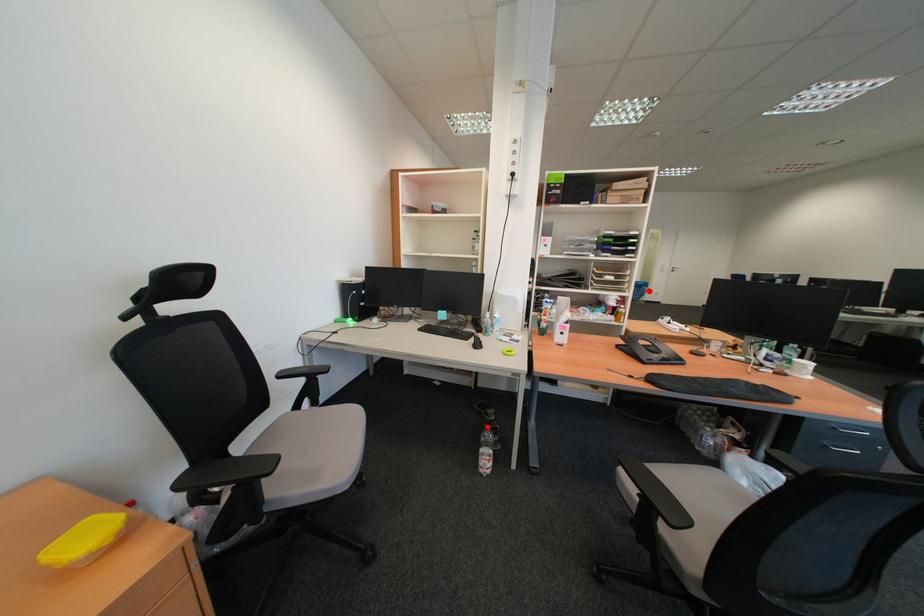
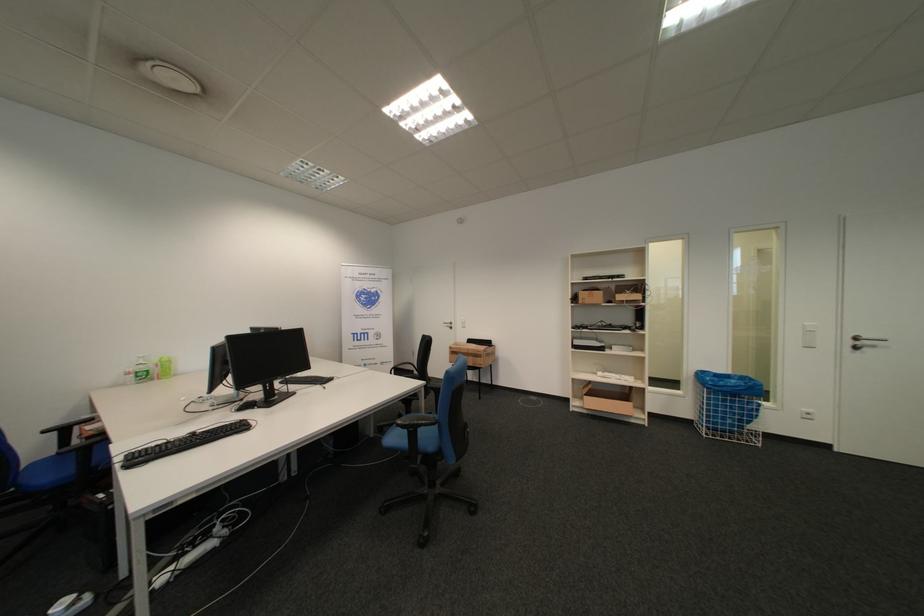
Find the pixel in the second image that matches the highlighted location in the first image.

(736, 402)